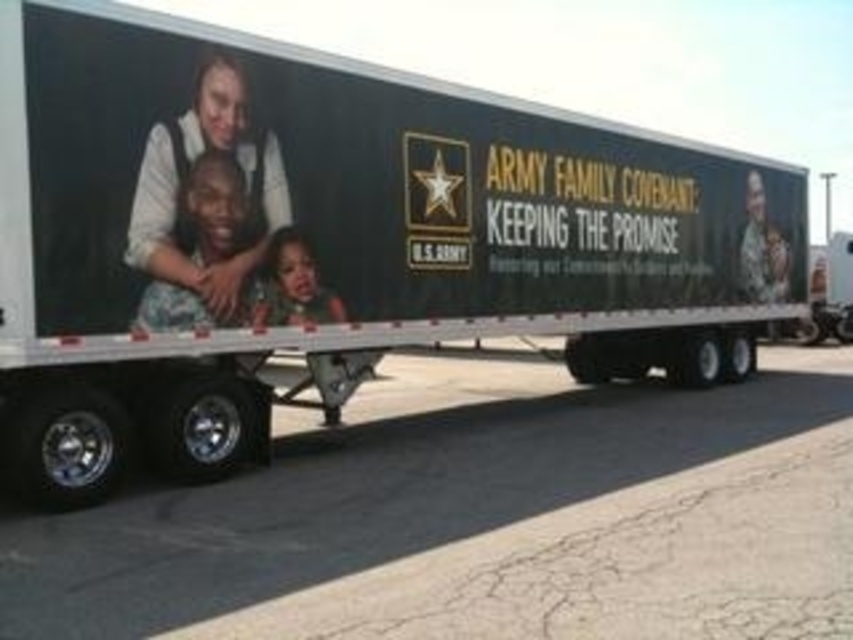
Based on the scene description, which object is bigger between the matte black uniform at center and the smooth skin child at center?

The matte black uniform at center is larger in size than the smooth skin child at center.

You are standing in front of the trailer and want to touch the matte black uniform at center. Where should you aim your hand to reach it?

The matte black uniform at center is located at the 2D coordinates point (x=216, y=211) on the advertisement, so you should aim your hand at that specific point.